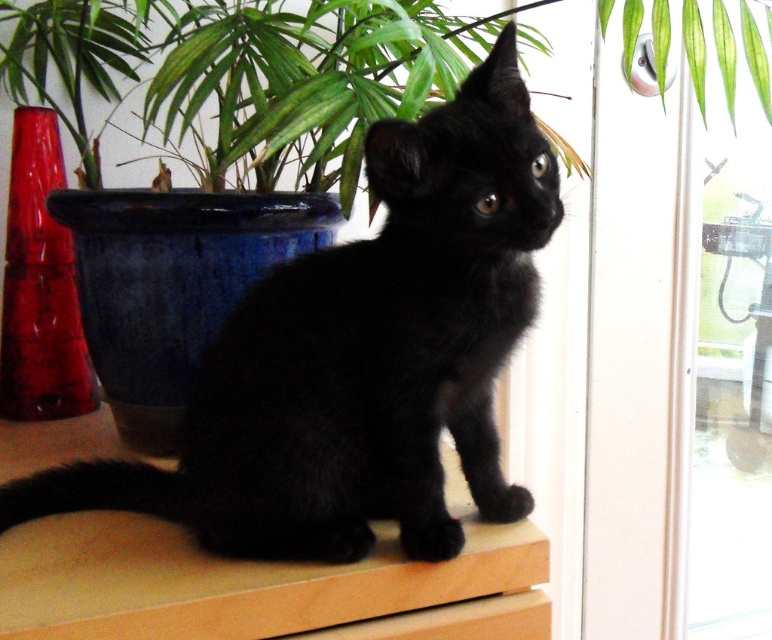
From the picture: You are a photographer trying to capture a photo of the black matte fur cat at center and the glossy ceramic pot at upper center. You want to ensure both subjects are in focus. Since the cat is much taller than the pot, which subject should you focus on first to ensure depth of field?

The black matte fur cat at center is much taller than the glossy ceramic pot at upper center, so you should focus on the taller subject first to ensure both are in focus.

You are a cat owner who wants to ensure your black matte fur cat at center has enough space to move around comfortably on the light wooden surface. The recommended minimum space for a cat is 40 centimeters. Can the cat move freely between itself and the glossy ceramic pot at upper center?

The distance between the black matte fur cat at center and the glossy ceramic pot at upper center is 30.15 centimeters. Since this is less than the recommended 40 centimeters, the cat may not have enough space to move freely between them.

You are a photographer trying to capture the black matte fur cat at center and the glossy ceramic pot at upper center in the same frame. If your camera can only focus on objects wider than 10 cm, will both objects be in focus?

The black matte fur cat at center has a width less than the glossy ceramic pot at upper center. Since the camera focuses on objects wider than 10 cm, only the glossy ceramic pot at upper center will be in focus if it meets the width requirement, but the cat might not be. However, without exact measurements, we can only confirm the pot is wider than the cat.